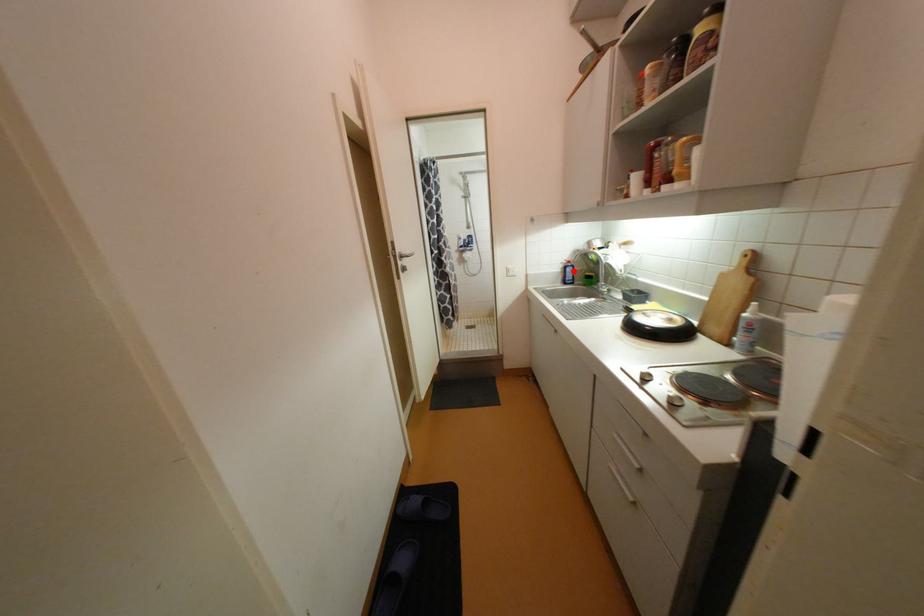
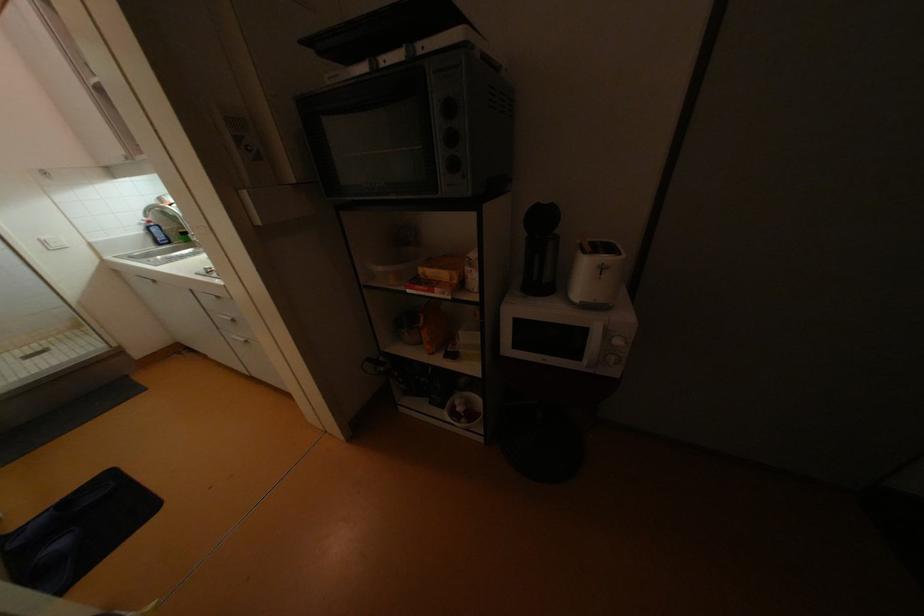
Question: A red point is marked in image1. In image2, is the corresponding 3D point closer to the camera or farther? Reply with the corresponding letter.

Choices:
 (A) The corresponding 3D point is closer.
 (B) The corresponding 3D point is farther.

Answer: (B)